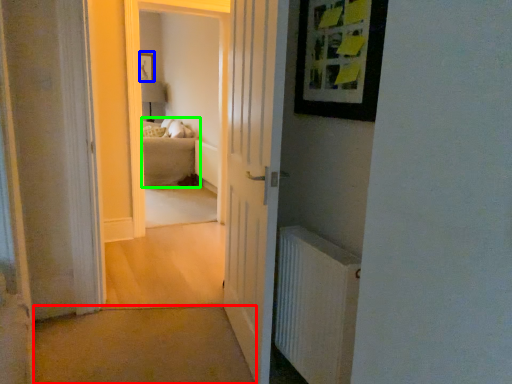
Question: Considering the real-world distances, which object is closest to path (highlighted by a red box)? picture frame (highlighted by a blue box) or couch (highlighted by a green box).

Choices:
 (A) picture frame
 (B) couch

Answer: (B)